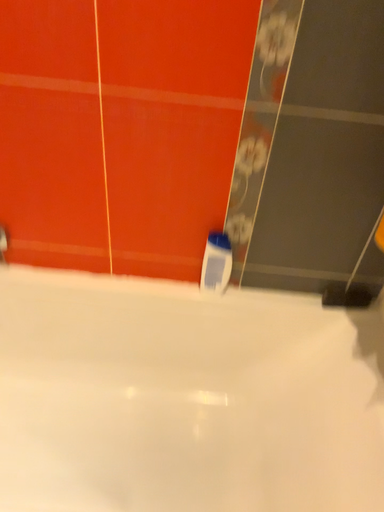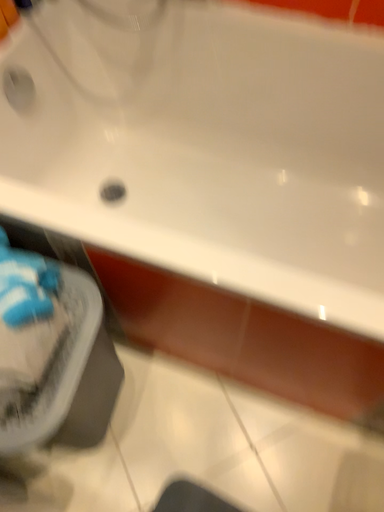
Question: Which way did the camera rotate in the video?

Choices:
 (A) rotated right
 (B) rotated left

Answer: (B)